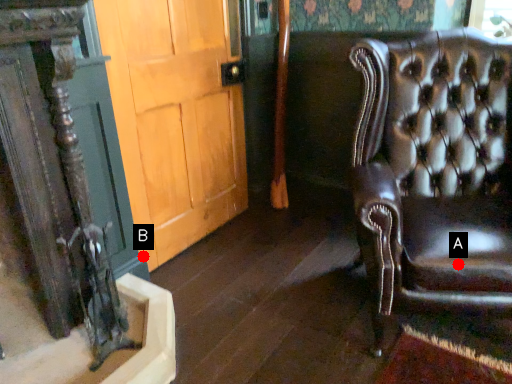
Question: Two points are circled on the image, labeled by A and B beside each circle. Which point appears farthest from the camera in this image?

Choices:
 (A) A is further
 (B) B is further

Answer: (B)